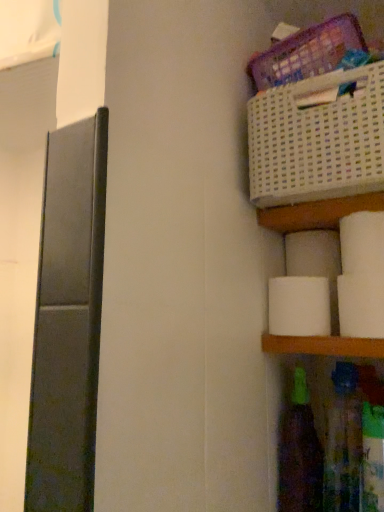
Question: In terms of size, does white matte toilet paper at right, marked as the 3th toilet paper in a front-to-back arrangement, appear bigger or smaller than translucent plastic bottle at lower right, the first bottle in the left-to-right sequence?

Choices:
 (A) big
 (B) small

Answer: (B)

Question: Is white matte toilet paper at right, marked as the 3th toilet paper in a front-to-back arrangement, wider or thinner than translucent plastic bottle at lower right, which is the second bottle from right to left?

Choices:
 (A) thin
 (B) wide

Answer: (A)

Question: Which object is positioned closest to the white matte toilet paper at lower right, arranged as the first toilet paper when viewed from the front?

Choices:
 (A) white matte toilet paper at right, marked as the 3th toilet paper in a front-to-back arrangement
 (B) white matte toilet paper at right, which is the 3th toilet paper from back to front
 (C) translucent plastic bottle at lower right, the first bottle in the left-to-right sequence
 (D) translucent plastic bottle at lower right, which appears as the 2th bottle when viewed from the left
 (E) white plastic basket at upper right

Answer: (B)

Question: Which of these objects is positioned farthest from the translucent plastic bottle at lower right, the first bottle in the left-to-right sequence?

Choices:
 (A) white matte toilet paper at lower right, arranged as the first toilet paper when viewed from the front
 (B) white matte toilet paper at right, marked as the 3th toilet paper in a front-to-back arrangement
 (C) white matte toilet paper at right, which is the 3th toilet paper from back to front
 (D) translucent plastic bottle at lower right, the first bottle from the right
 (E) white matte toilet paper at right, which ranks as the first toilet paper in back-to-front order

Answer: (C)